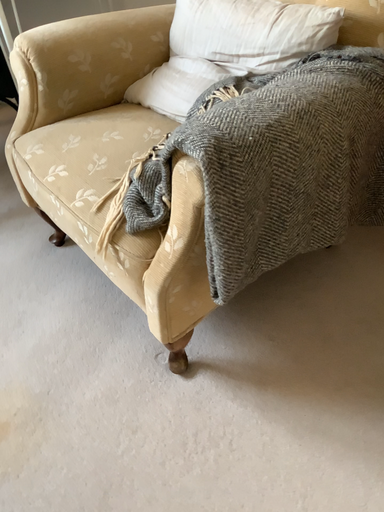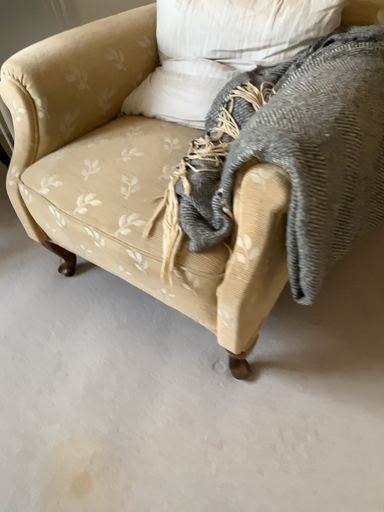
Question: How did the camera likely rotate when shooting the video?

Choices:
 (A) rotated left
 (B) rotated right

Answer: (B)